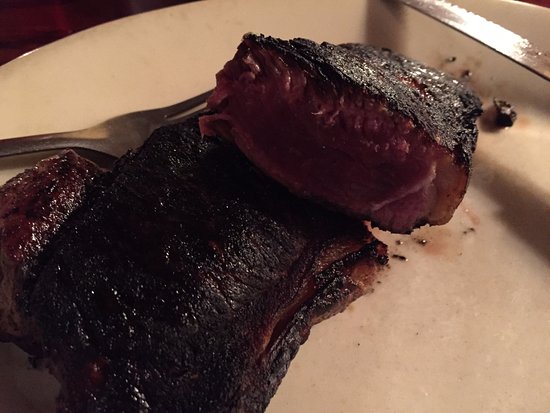
Locate an element on the screen. The height and width of the screenshot is (413, 550). plate is located at coordinates (460, 342).